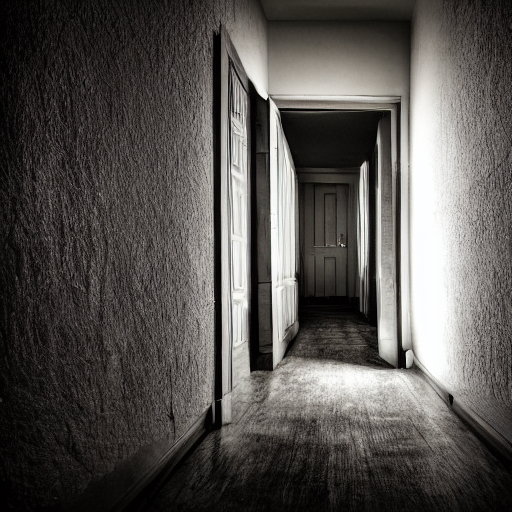
At what (x,y) coordinates should I click in order to perform the action: click on door frame. Please return your answer as a coordinate pair (x, y). Looking at the image, I should click on pyautogui.click(x=316, y=100).